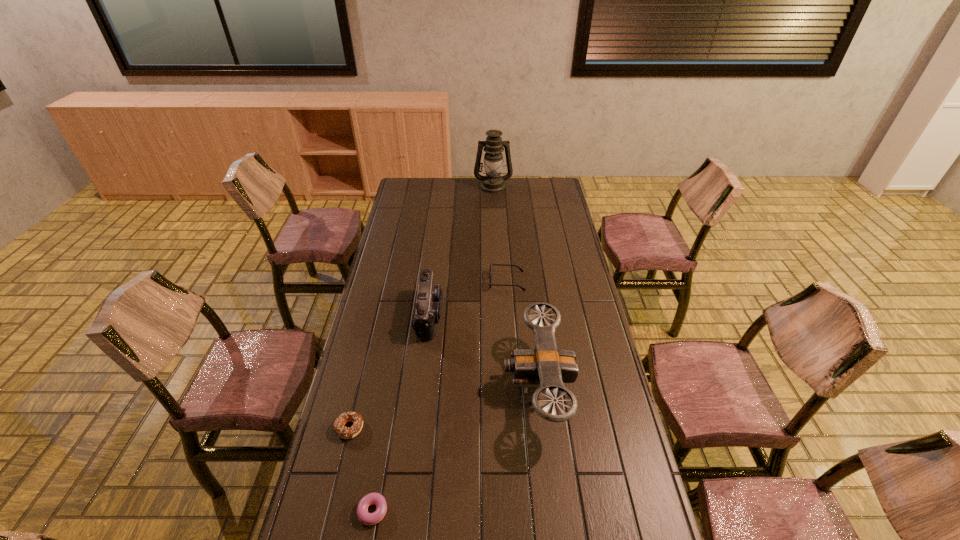
Where is `free space between the shorter doughnut and the fourth tallest object`? This screenshot has width=960, height=540. free space between the shorter doughnut and the fourth tallest object is located at coordinates (440, 396).

The height and width of the screenshot is (540, 960). What are the coordinates of `free spot between the camcorder and the nearest object` in the screenshot? It's located at (400, 413).

Identify the location of blank region between the fifth shortest object and the spectacles. The height and width of the screenshot is (540, 960). (522, 334).

You are a GUI agent. You are given a task and a screenshot of the screen. Output one action in this format:
    pyautogui.click(x=<x>, y=<y>)
    Task: Click on the empty space that is in between the tallest object and the right doughnut
    Image resolution: width=960 pixels, height=540 pixels.
    Given the screenshot: What is the action you would take?
    pyautogui.click(x=432, y=349)

Identify which object is the fourth nearest to the farther doughnut. Please provide its 2D coordinates. Your answer should be formatted as a tuple, i.e. [(x, y)], where the tuple contains the x and y coordinates of a point satisfying the conditions above.

[(520, 269)]

What are the coordinates of `object that is the second closest one to the taller doughnut` in the screenshot? It's located at (429, 299).

Where is `vacant point that satisfies the following two spatial constraints: 1. on the front side of the nearer doughnut; 2. on the left side of the fifth tallest object`? vacant point that satisfies the following two spatial constraints: 1. on the front side of the nearer doughnut; 2. on the left side of the fifth tallest object is located at coordinates (329, 511).

Image resolution: width=960 pixels, height=540 pixels. I want to click on vacant space that satisfies the following two spatial constraints: 1. on the front-facing side of the fourth tallest object; 2. on the front side of the left doughnut, so click(x=517, y=428).

I want to click on vacant space that satisfies the following two spatial constraints: 1. on the front-facing side of the fourth tallest object; 2. on the front side of the nearer doughnut, so click(523, 511).